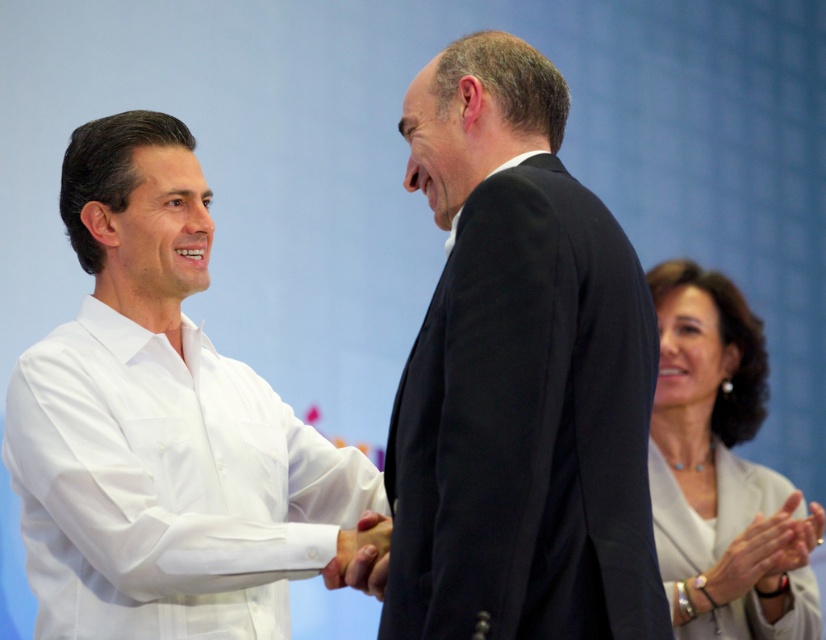
Question: Which of the following is the closest to the observer?

Choices:
 (A) smooth white hand at center
 (B) smooth skin hand at lower right
 (C) black suit at center
 (D) white matte hand at center

Answer: (C)

Question: Is white silk blouse at right in front of smooth white hand at center?

Choices:
 (A) yes
 (B) no

Answer: (A)

Question: Does white matte hand at center have a smaller size compared to smooth skin hand at lower right?

Choices:
 (A) yes
 (B) no

Answer: (A)

Question: Which object appears farthest from the camera in this image?

Choices:
 (A) smooth skin hand at lower right
 (B) smooth white hand at center
 (C) white matte hand at center
 (D) black suit at center

Answer: (B)

Question: Which object is positioned farthest from the smooth white hand at center?

Choices:
 (A) black suit at center
 (B) white silk blouse at right
 (C) white cotton shirt at center

Answer: (A)

Question: Considering the relative positions of smooth white hand at center and smooth skin hand at lower right in the image provided, where is smooth white hand at center located with respect to smooth skin hand at lower right?

Choices:
 (A) below
 (B) above

Answer: (A)